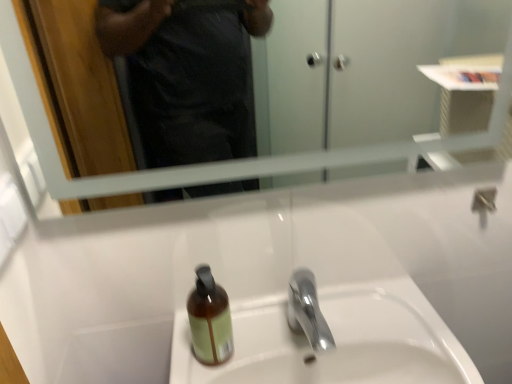
Locate an element on the screen. vacant area to the right of polished chrome faucet at center is located at coordinates (381, 324).